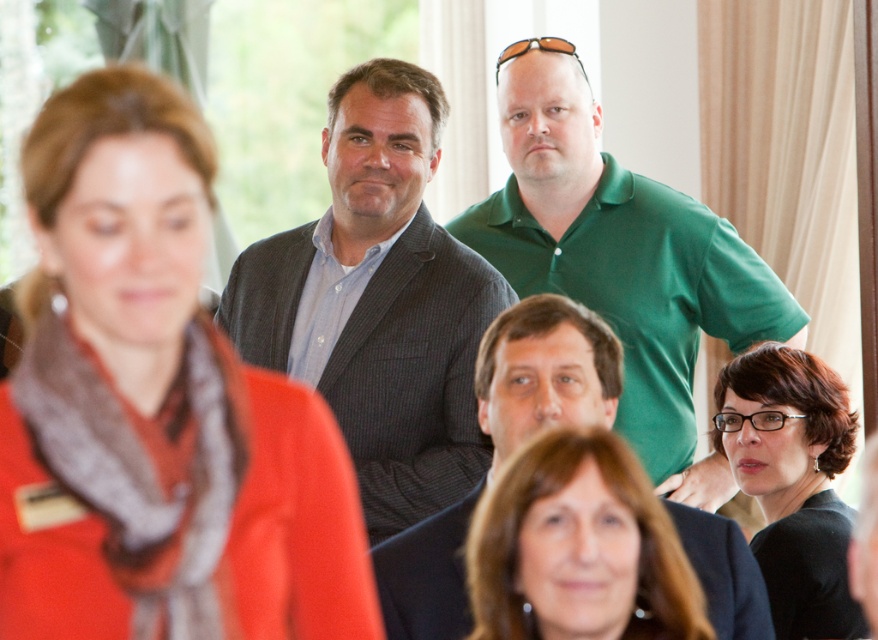
Consider the image. You are a photographer adjusting the camera settings to focus on the two central objects in the scene. Which object should you zoom in on to ensure it fills the frame more effectively, the matte brown hair at center or the black glossy glasses at center?

The matte brown hair at center has a smaller size compared to the black glossy glasses at center. Therefore, to fill the frame more effectively, you should zoom in on the black glossy glasses at center since it is larger.

You are organizing a photo shoot and need to adjust the camera focus to capture both the matte red scarf at center and the green smooth shirt at upper center clearly. Given that the camera has a depth of field that can sharply focus on objects within a 2 meter range, will both items be in focus?

The matte red scarf at center and the green smooth shirt at upper center are 1.95 meters apart, which is within the camera s 2 meter depth of field range. Therefore, both items will be in focus.